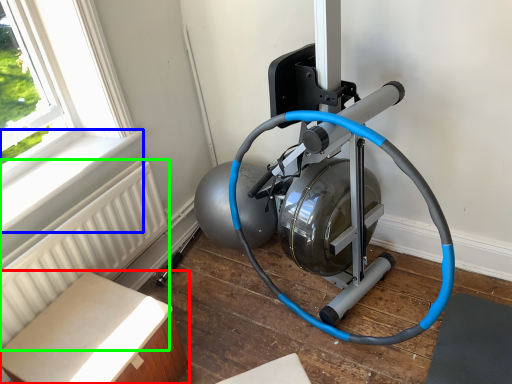
Question: Based on their relative distances, which object is nearer to furniture (highlighted by a red box)? Choose from window sill (highlighted by a blue box) and radiator (highlighted by a green box).

Choices:
 (A) window sill
 (B) radiator

Answer: (B)